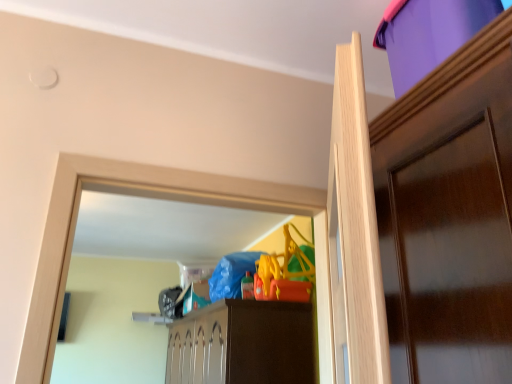
The height and width of the screenshot is (384, 512). What do you see at coordinates (243, 344) in the screenshot?
I see `brown matte cabinet at center` at bounding box center [243, 344].

You are a GUI agent. You are given a task and a screenshot of the screen. Output one action in this format:
    pyautogui.click(x=<x>, y=<y>)
    Task: Click on the brown matte cabinet at center
    
    Given the screenshot: What is the action you would take?
    pyautogui.click(x=243, y=344)

Where is `brown matte cabinet at center`? brown matte cabinet at center is located at coordinates (243, 344).